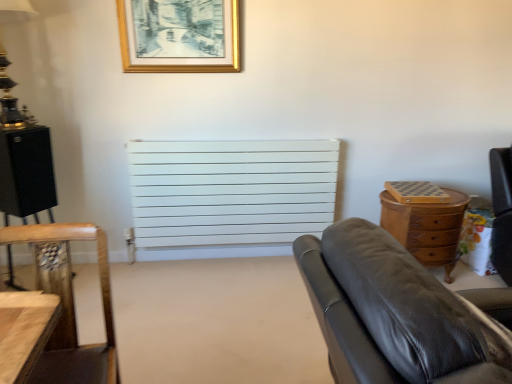
This screenshot has height=384, width=512. Describe the element at coordinates (231, 191) in the screenshot. I see `white matte radiator at center` at that location.

What do you see at coordinates (426, 228) in the screenshot? The height and width of the screenshot is (384, 512). I see `wooden chest of drawers at right` at bounding box center [426, 228].

The height and width of the screenshot is (384, 512). What do you see at coordinates (8, 96) in the screenshot?
I see `gold metallic lamp at upper left` at bounding box center [8, 96].

This screenshot has width=512, height=384. What do you see at coordinates (396, 313) in the screenshot?
I see `black leather couch at right` at bounding box center [396, 313].

Locate an element on the screen. Image resolution: width=512 pixels, height=384 pixels. wooden chair at lower left is located at coordinates (68, 304).

What is the approximate height of gold/golden frame at upper center?

The height of gold/golden frame at upper center is 17.15 inches.

Where is `white matte radiator at center`? This screenshot has height=384, width=512. white matte radiator at center is located at coordinates coord(231,191).

Which is more to the right, gold metallic lamp at upper left or white matte radiator at center?

white matte radiator at center is more to the right.

The width and height of the screenshot is (512, 384). Find the location of `radiator located below the gold metallic lamp at upper left (from the image's perspective)`. radiator located below the gold metallic lamp at upper left (from the image's perspective) is located at coordinates (231, 191).

Does point (23, 125) appear closer or farther from the camera than point (174, 230)?

Point (23, 125) is closer to the camera than point (174, 230).

Could you tell me if gold metallic lamp at upper left is turned towards white matte radiator at center?

No, gold metallic lamp at upper left is not aimed at white matte radiator at center.

Are gold/golden frame at upper center and gold metallic lamp at upper left located far from each other?

Actually, gold/golden frame at upper center and gold metallic lamp at upper left are a little close together.

From a real-world perspective, is gold/golden frame at upper center physically located above or below gold metallic lamp at upper left?

gold/golden frame at upper center is situated higher than gold metallic lamp at upper left in the real world.

Locate an element on the screen. picture frame that appears behind the gold metallic lamp at upper left is located at coordinates (179, 36).

Looking at this image, from the image's perspective, is gold/golden frame at upper center under gold metallic lamp at upper left?

Actually, gold/golden frame at upper center appears above gold metallic lamp at upper left in the image.

Considering the relative positions of gold metallic lamp at upper left and black leather couch at right in the image provided, is gold metallic lamp at upper left behind black leather couch at right?

Yes, gold metallic lamp at upper left is further from the viewer.

From a real-world perspective, is gold metallic lamp at upper left over black leather couch at right?

Indeed, from a real-world perspective, gold metallic lamp at upper left stands above black leather couch at right.

Which object is thinner, gold metallic lamp at upper left or black leather couch at right?

With smaller width is gold metallic lamp at upper left.

Where is `lamp behind the black leather couch at right`? The height and width of the screenshot is (384, 512). lamp behind the black leather couch at right is located at coordinates (8, 96).

Could you tell me if white matte radiator at center is facing wooden chest of drawers at right?

No, white matte radiator at center is not facing towards wooden chest of drawers at right.

Identify the location of radiator behind the wooden chest of drawers at right. Image resolution: width=512 pixels, height=384 pixels. (231, 191).

Looking at this image, considering their positions, is white matte radiator at center located in front of or behind wooden chest of drawers at right?

white matte radiator at center is positioned farther from the viewer than wooden chest of drawers at right.

Is white matte radiator at center far away from wooden chest of drawers at right?

Actually, white matte radiator at center and wooden chest of drawers at right are a little close together.

Considering the sizes of objects gold metallic lamp at upper left and wooden chair at lower left in the image provided, who is thinner, gold metallic lamp at upper left or wooden chair at lower left?

Thinner between the two is gold metallic lamp at upper left.

Considering the sizes of objects gold metallic lamp at upper left and wooden chair at lower left in the image provided, who is smaller, gold metallic lamp at upper left or wooden chair at lower left?

gold metallic lamp at upper left is smaller.

From the image's perspective, is gold metallic lamp at upper left above or below wooden chair at lower left?

Clearly, from the image's perspective, gold metallic lamp at upper left is above wooden chair at lower left.

From a real-world perspective, is gold metallic lamp at upper left positioned above or below wooden chair at lower left?

gold metallic lamp at upper left is situated higher than wooden chair at lower left in the real world.

Considering the sizes of objects wooden chair at lower left and white matte radiator at center in the image provided, who is shorter, wooden chair at lower left or white matte radiator at center?

wooden chair at lower left is shorter.

Is wooden chair at lower left positioned before white matte radiator at center?

Yes, it is.

How different are the orientations of wooden chair at lower left and white matte radiator at center in degrees?

They differ by 8.25 degrees in their facing directions.

Considering their positions, is wooden chair at lower left located in front of or behind gold/golden frame at upper center?

Clearly, wooden chair at lower left is in front of gold/golden frame at upper center.

Is wooden chair at lower left at the right side of gold/golden frame at upper center?

In fact, wooden chair at lower left is to the left of gold/golden frame at upper center.

Would you consider wooden chair at lower left to be distant from gold/golden frame at upper center?

Yes, wooden chair at lower left and gold/golden frame at upper center are located far from each other.

Is wooden chair at lower left oriented towards gold/golden frame at upper center?

No, wooden chair at lower left does not turn towards gold/golden frame at upper center.

At what (x,y) coordinates should I click in order to perform the action: click on lamp that appears above the white matte radiator at center (from the image's perspective). Please return your answer as a coordinate pair (x, y). This screenshot has height=384, width=512. Looking at the image, I should click on (8, 96).

I want to click on lamp below the gold/golden frame at upper center (from a real-world perspective), so click(x=8, y=96).

Estimate the real-world distances between objects in this image. Which object is further from black leather couch at right, gold/golden frame at upper center or wooden chair at lower left?

The object further to black leather couch at right is gold/golden frame at upper center.

Which object lies nearer to the anchor point white matte radiator at center, gold metallic lamp at upper left or wooden chest of drawers at right?

wooden chest of drawers at right.

Looking at the image, which one is located closer to white matte radiator at center, wooden chair at lower left or black leather couch at right?

Among the two, wooden chair at lower left is located nearer to white matte radiator at center.

Looking at the image, which one is located further to black leather couch at right, wooden chair at lower left or wooden chest of drawers at right?

The object further to black leather couch at right is wooden chest of drawers at right.

From the picture: Based on their spatial positions, is white matte radiator at center or wooden chest of drawers at right further from gold/golden frame at upper center?

wooden chest of drawers at right is positioned further to the anchor gold/golden frame at upper center.

When comparing their distances from gold metallic lamp at upper left, does black leather couch at right or wooden chair at lower left seem closer?

wooden chair at lower left.

From the image, which object appears to be farther from white matte radiator at center, gold/golden frame at upper center or gold metallic lamp at upper left?

Among the two, gold metallic lamp at upper left is located further to white matte radiator at center.

When comparing their distances from gold metallic lamp at upper left, does wooden chair at lower left or white matte radiator at center seem closer?

white matte radiator at center is closer to gold metallic lamp at upper left.

You are a GUI agent. You are given a task and a screenshot of the screen. Output one action in this format:
    pyautogui.click(x=<x>, y=<y>)
    Task: Click on the lamp located between wooden chair at lower left and gold/golden frame at upper center in the depth direction
    This screenshot has width=512, height=384.
    Given the screenshot: What is the action you would take?
    pyautogui.click(x=8, y=96)

Find the location of a particular element. The height and width of the screenshot is (384, 512). picture frame between gold metallic lamp at upper left and black leather couch at right from left to right is located at coordinates (179, 36).

Locate an element on the screen. studio couch between gold metallic lamp at upper left and wooden chest of drawers at right from left to right is located at coordinates (396, 313).

The image size is (512, 384). In order to click on picture frame between black leather couch at right and white matte radiator at center along the z-axis in this screenshot , I will do `click(179, 36)`.